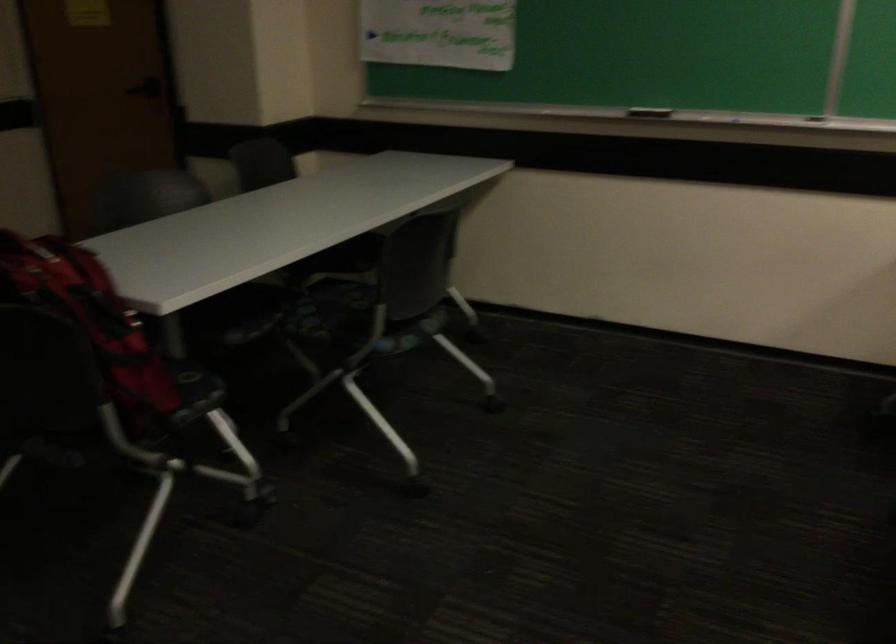
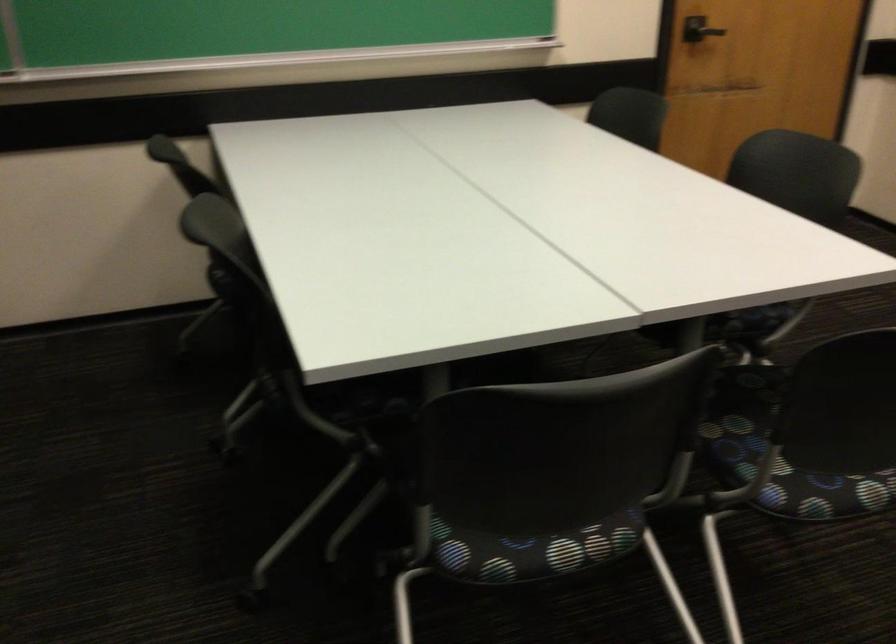
Question: How did the camera likely rotate?

Choices:
 (A) Left
 (B) Right
 (C) Up
 (D) Down

Answer: (B)